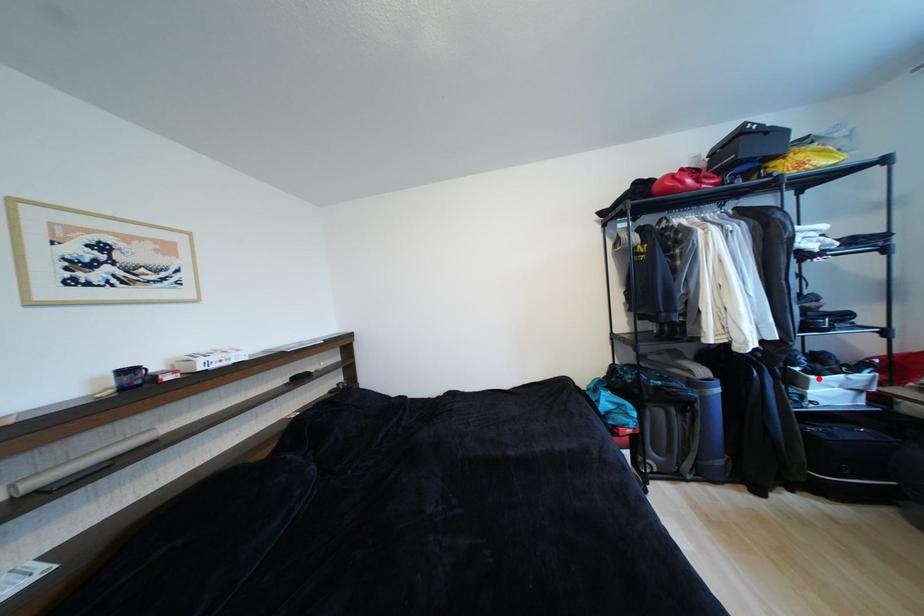
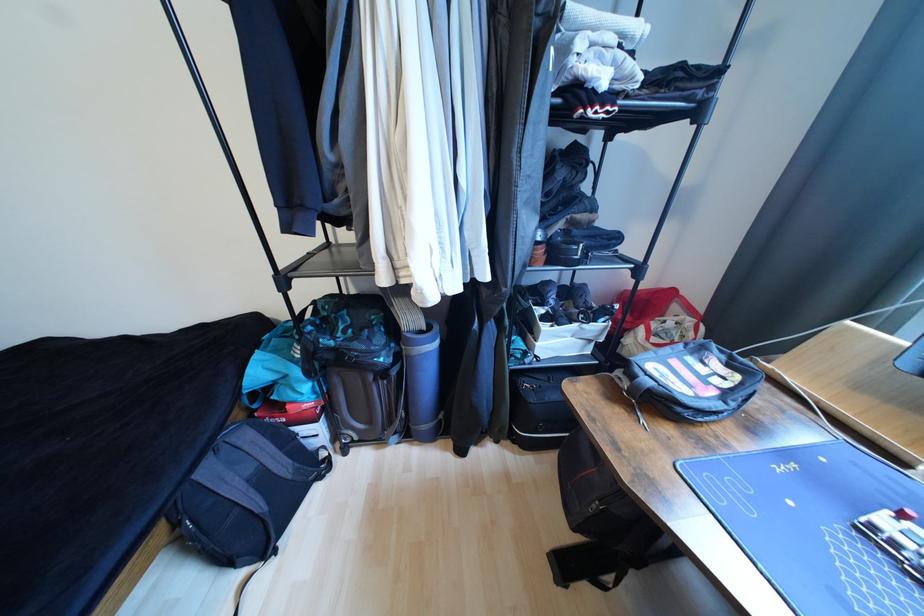
Locate, in the second image, the point that corresponds to the highlighted location in the first image.

(552, 329)